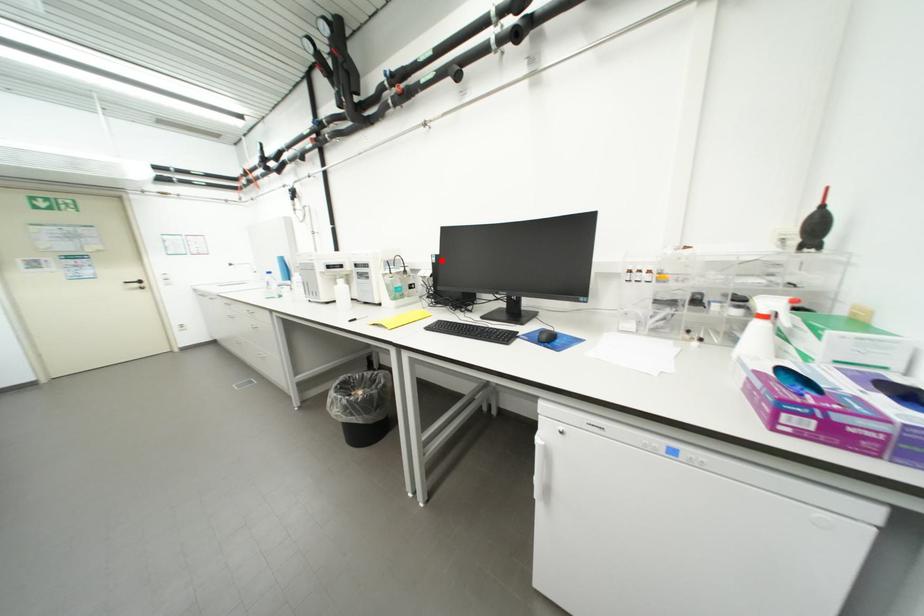
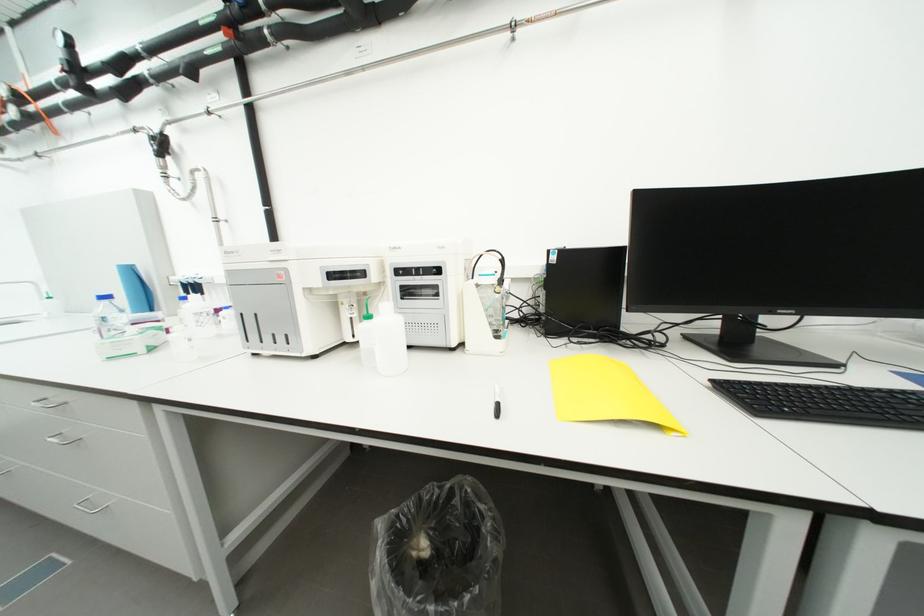
Locate, in the second image, the point that corresponds to the highlighted location in the first image.

(562, 259)